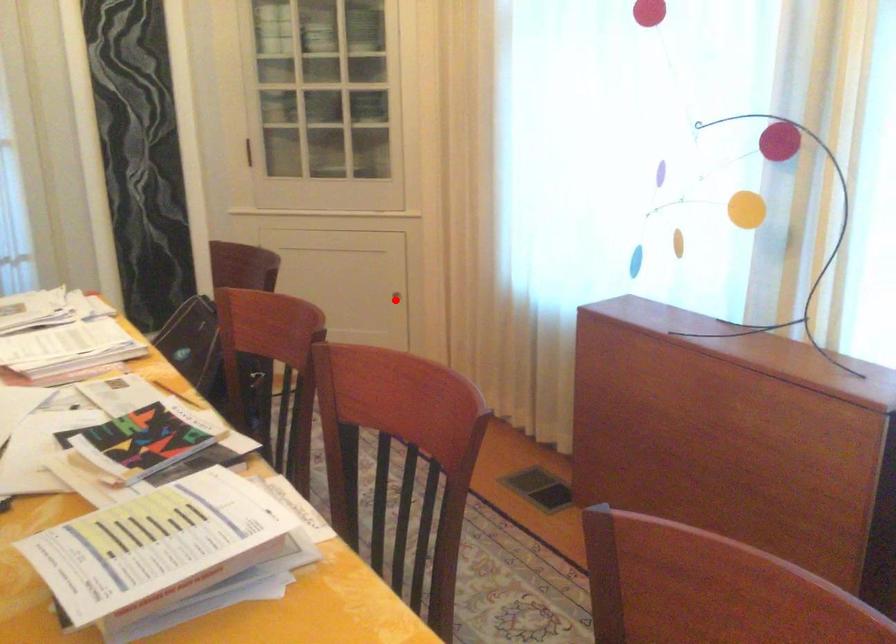
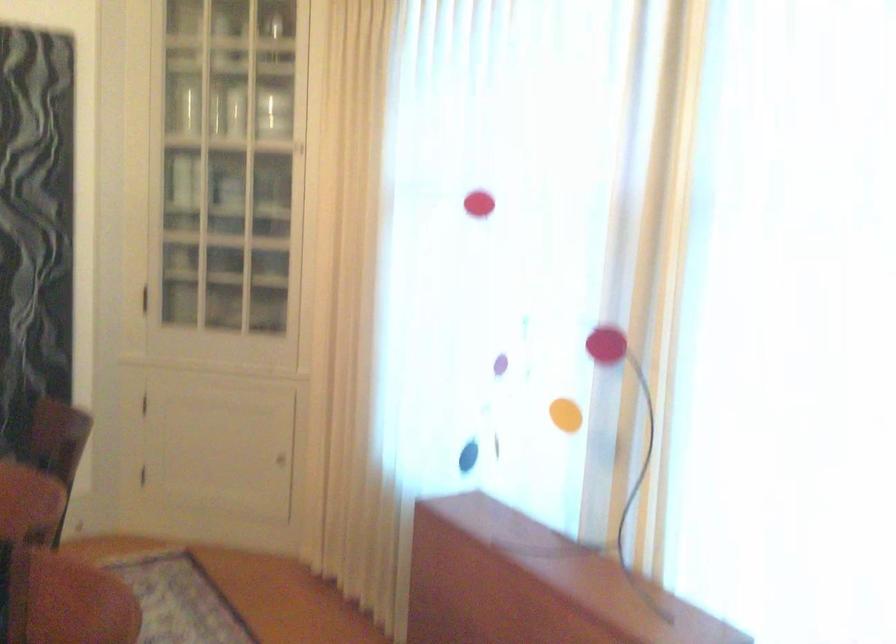
In the second image, find the point that corresponds to the highlighted location in the first image.

(280, 460)